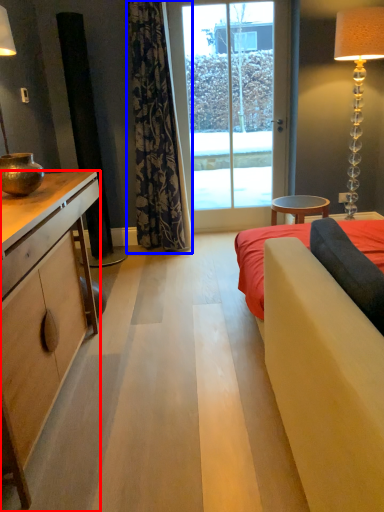
Question: Among these objects, which one is nearest to the camera, cabinetry (highlighted by a red box) or curtain (highlighted by a blue box)?

Choices:
 (A) cabinetry
 (B) curtain

Answer: (A)